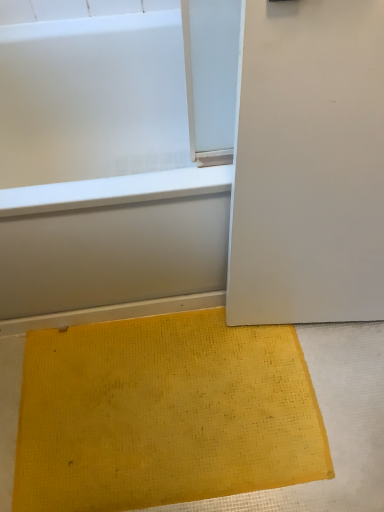
The width and height of the screenshot is (384, 512). In order to click on white glossy bathtub at lower left in this screenshot , I will do `click(107, 181)`.

Describe the element at coordinates (107, 181) in the screenshot. I see `white glossy bathtub at lower left` at that location.

At what (x,y) coordinates should I click in order to perform the action: click on yellow woven mat at lower center. Please return your answer as a coordinate pair (x, y). The width and height of the screenshot is (384, 512). Looking at the image, I should click on pos(163,414).

The height and width of the screenshot is (512, 384). What do you see at coordinates (163, 414) in the screenshot?
I see `yellow woven mat at lower center` at bounding box center [163, 414].

The height and width of the screenshot is (512, 384). In order to click on white glossy bathtub at lower left in this screenshot , I will do `click(107, 181)`.

Can you confirm if yellow woven mat at lower center is positioned to the left of white glossy bathtub at lower left?

Incorrect, yellow woven mat at lower center is not on the left side of white glossy bathtub at lower left.

Considering the positions of objects yellow woven mat at lower center and white glossy bathtub at lower left in the image provided, who is in front, yellow woven mat at lower center or white glossy bathtub at lower left?

Positioned in front is white glossy bathtub at lower left.

Is point (267, 425) closer to viewer compared to point (22, 241)?

No, (267, 425) is further to viewer.

From the picture: From the image's perspective, which object appears higher, yellow woven mat at lower center or white glossy bathtub at lower left?

white glossy bathtub at lower left, from the image's perspective.

From a real-world perspective, is yellow woven mat at lower center on white glossy bathtub at lower left?

No, from a real-world perspective, yellow woven mat at lower center is not above white glossy bathtub at lower left.

Does yellow woven mat at lower center have a lesser width compared to white glossy bathtub at lower left?

Yes.

Looking at this image, which of these two, yellow woven mat at lower center or white glossy bathtub at lower left, stands shorter?

yellow woven mat at lower center is shorter.

Considering the relative sizes of yellow woven mat at lower center and white glossy bathtub at lower left in the image provided, is yellow woven mat at lower center smaller than white glossy bathtub at lower left?

Correct, yellow woven mat at lower center occupies less space than white glossy bathtub at lower left.

In the scene shown: Is yellow woven mat at lower center located outside white glossy bathtub at lower left?

Absolutely, yellow woven mat at lower center is external to white glossy bathtub at lower left.

Is yellow woven mat at lower center next to white glossy bathtub at lower left and touching it?

yellow woven mat at lower center and white glossy bathtub at lower left are not in contact.

Is yellow woven mat at lower center facing towards white glossy bathtub at lower left?

No, yellow woven mat at lower center is not turned towards white glossy bathtub at lower left.

What's the angular difference between yellow woven mat at lower center and white glossy bathtub at lower left's facing directions?

The angle between the facing direction of yellow woven mat at lower center and the facing direction of white glossy bathtub at lower left is 0.153 degrees.

This screenshot has height=512, width=384. In order to click on bathtub in front of the yellow woven mat at lower center in this screenshot , I will do `click(107, 181)`.

Considering the positions of objects white glossy bathtub at lower left and yellow woven mat at lower center in the image provided, who is more to the left, white glossy bathtub at lower left or yellow woven mat at lower center?

Positioned to the left is white glossy bathtub at lower left.

Is white glossy bathtub at lower left positioned before yellow woven mat at lower center?

Yes.

Is point (218, 269) farther from camera compared to point (245, 387)?

No.

From the image's perspective, which is above, white glossy bathtub at lower left or yellow woven mat at lower center?

white glossy bathtub at lower left appears higher in the image.

From a real-world perspective, between white glossy bathtub at lower left and yellow woven mat at lower center, who is vertically higher?

white glossy bathtub at lower left is physically above.

Which of these two, white glossy bathtub at lower left or yellow woven mat at lower center, is wider?

white glossy bathtub at lower left.

From their relative heights in the image, would you say white glossy bathtub at lower left is taller or shorter than yellow woven mat at lower center?

white glossy bathtub at lower left is taller than yellow woven mat at lower center.

Is white glossy bathtub at lower left bigger than yellow woven mat at lower center?

Correct, white glossy bathtub at lower left is larger in size than yellow woven mat at lower center.

Do you think white glossy bathtub at lower left is within yellow woven mat at lower center, or outside of it?

white glossy bathtub at lower left lies outside yellow woven mat at lower center.

From the picture: Is white glossy bathtub at lower left next to yellow woven mat at lower center?

No, white glossy bathtub at lower left is not making contact with yellow woven mat at lower center.

Is white glossy bathtub at lower left facing away from yellow woven mat at lower center?

white glossy bathtub at lower left does not have its back to yellow woven mat at lower center.

How many degrees apart are the facing directions of white glossy bathtub at lower left and yellow woven mat at lower center?

The facing directions of white glossy bathtub at lower left and yellow woven mat at lower center are 0.153 degrees apart.

Locate an element on the screen. The width and height of the screenshot is (384, 512). doormat that is below the white glossy bathtub at lower left (from the image's perspective) is located at coordinates (163, 414).

Locate an element on the screen. The height and width of the screenshot is (512, 384). doormat that appears below the white glossy bathtub at lower left (from the image's perspective) is located at coordinates (163, 414).

Locate an element on the screen. This screenshot has width=384, height=512. bathtub that is on the left side of yellow woven mat at lower center is located at coordinates (107, 181).